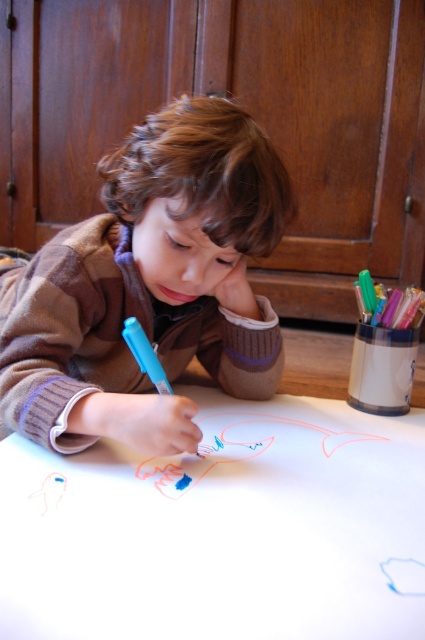
You are a parent standing in the room and want to hand your child a new marker. The marker is in your hand, and you need to place it on the white paper at center. Can you reach the paper without moving closer? Assume your arm can extend 12 inches.

The distance between you and the white paper at center is 12.39 inches, which is slightly longer than your arm extension of 12 inches. Therefore, you cannot reach the paper without moving closer.

You are a photographer trying to capture a closeup of the child drawing. You notice two points in the scene at coordinates point (413, 468) and point (147, 333). Which point should you focus on to ensure the child is in sharp focus?

Point (413, 468) is closer to the camera than point (147, 333), so focusing on point (413, 468) will ensure the child is in sharp focus.

You are an art teacher observing a child drawing. The child is wearing a matte brown sweater at center and drawing on a white paper at center. You need to hand them a new marker. Which object is closer to your hand if you reach out directly in front of you?

The white paper at center is 6.14 inches from the matte brown sweater at center. Since the white paper is on the table where the child is drawing, it would be closer to your hand when reaching directly in front, while the matte brown sweater is part of the child and thus further away.